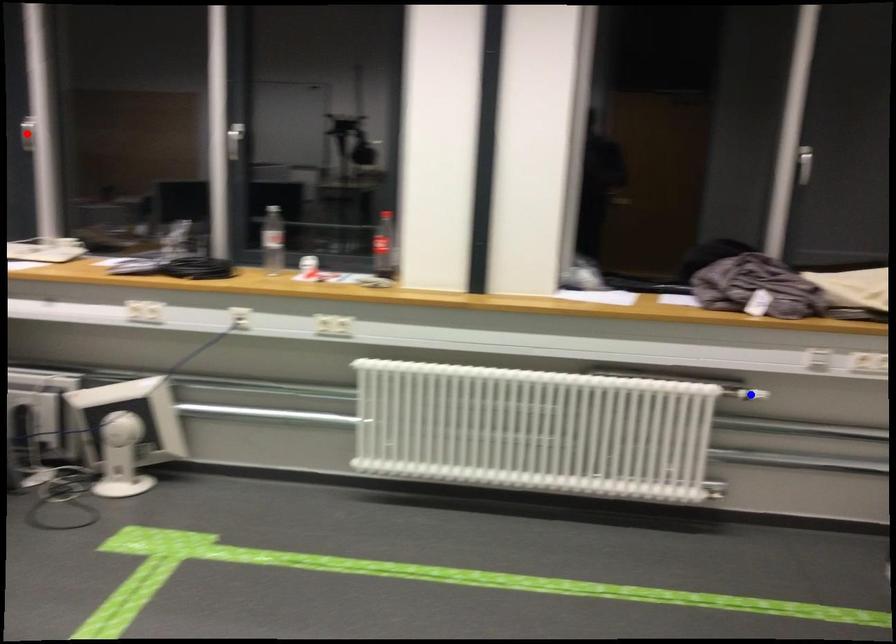
Question: Which of the two points in the image is closer to the camera?

Choices:
 (A) Blue point is closer.
 (B) Red point is closer.

Answer: (A)